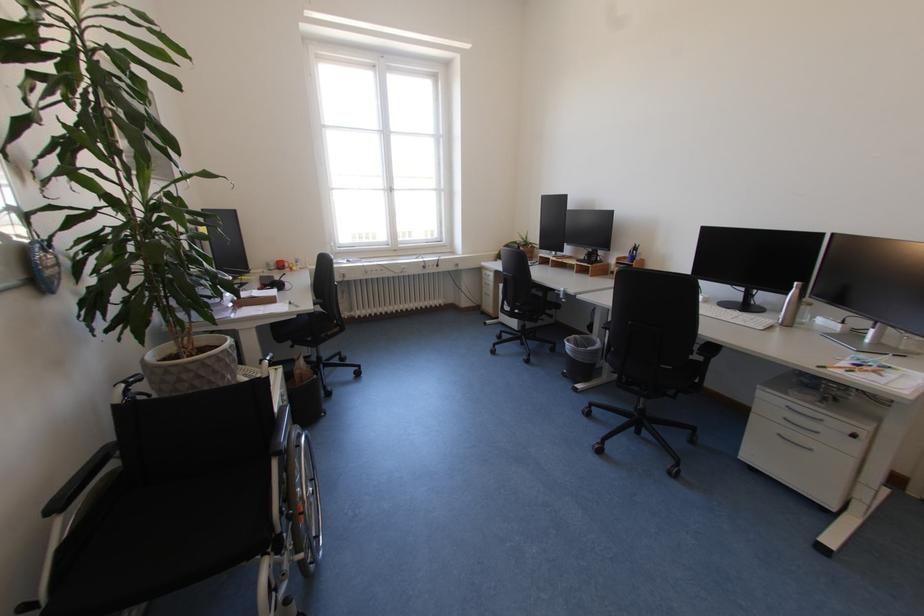
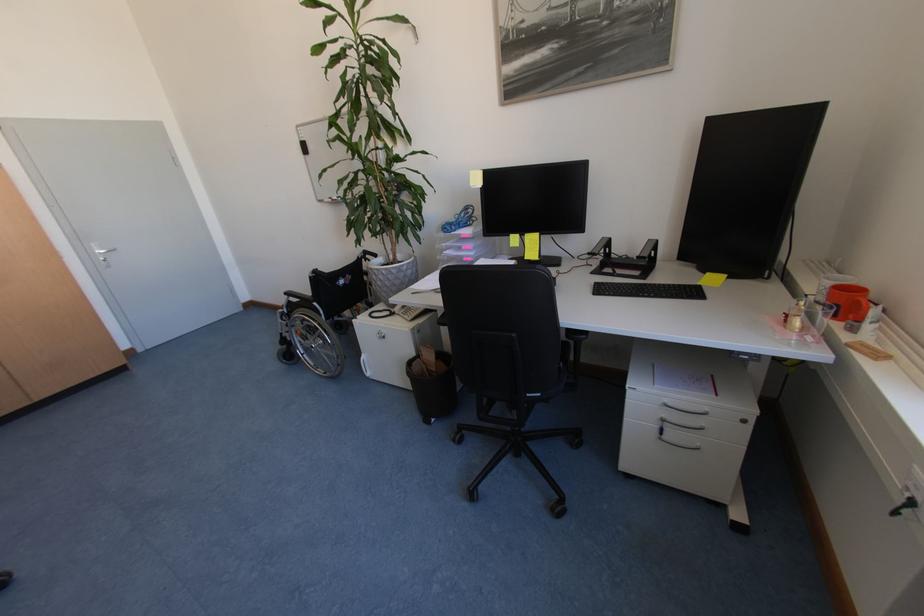
In the second image, find the point that corresponds to pixel 281 270 in the first image.

(824, 300)